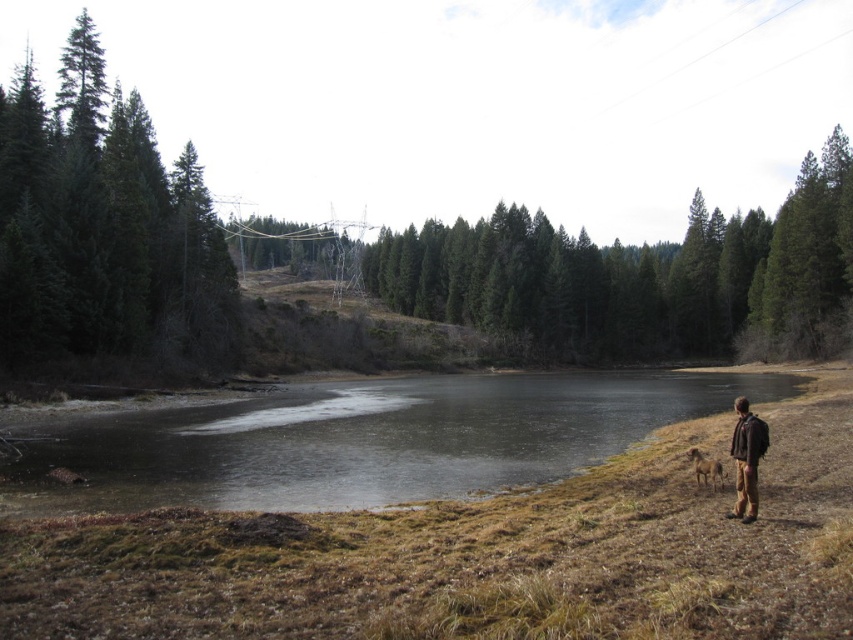
Between green matte tree at upper left and brown leather jacket at lower right, which one is positioned lower?

Positioned lower is brown leather jacket at lower right.

Who is positioned more to the right, green matte tree at upper left or brown leather jacket at lower right?

Positioned to the right is brown leather jacket at lower right.

Which is in front, point (206, 326) or point (738, 465)?

Point (738, 465) is in front.

Locate an element on the screen. This screenshot has width=853, height=640. green matte tree at upper left is located at coordinates (103, 228).

Between point (306, 460) and point (70, 58), which one is positioned behind?

Positioned behind is point (70, 58).

Who is positioned more to the left, frozen ice at lower center or green matte tree at upper left?

Positioned to the left is green matte tree at upper left.

Is point (281, 445) positioned behind point (32, 348)?

No, (281, 445) is closer to viewer.

Locate an element on the screen. Image resolution: width=853 pixels, height=640 pixels. frozen ice at lower center is located at coordinates (366, 440).

This screenshot has width=853, height=640. What do you see at coordinates (366, 440) in the screenshot?
I see `frozen ice at lower center` at bounding box center [366, 440].

Does point (546, 458) come behind point (740, 429)?

Yes.

Which is behind, point (120, 490) or point (752, 474)?

The point (120, 490) is more distant.

Identify the location of frozen ice at lower center. The width and height of the screenshot is (853, 640). (366, 440).